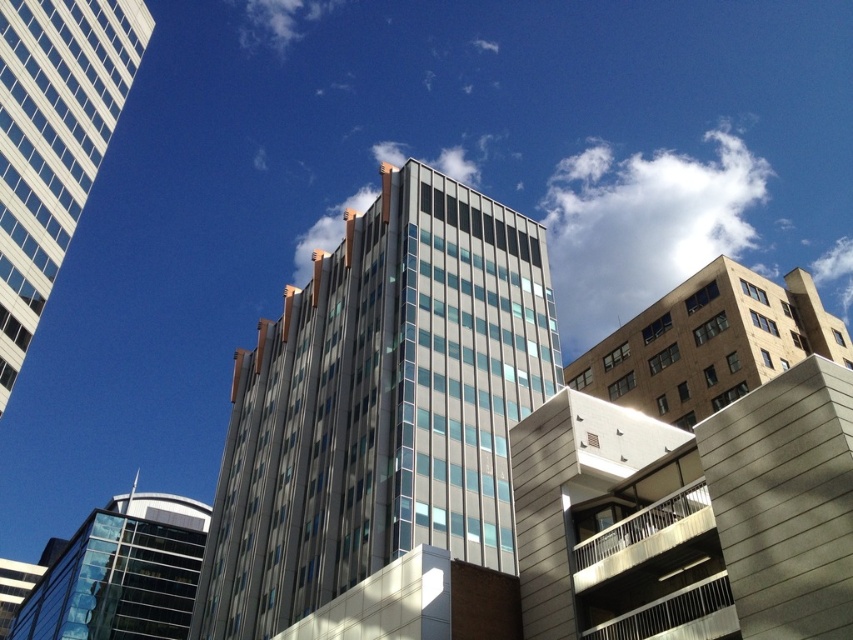
Who is shorter, metallic glass building at center or white glass building at upper left?

Standing shorter between the two is white glass building at upper left.

Can you confirm if metallic glass building at center is bigger than white glass building at upper left?

Yes.

What do you see at coordinates (380, 404) in the screenshot?
I see `metallic glass building at center` at bounding box center [380, 404].

Find the location of a particular element. The image size is (853, 640). metallic glass building at center is located at coordinates (380, 404).